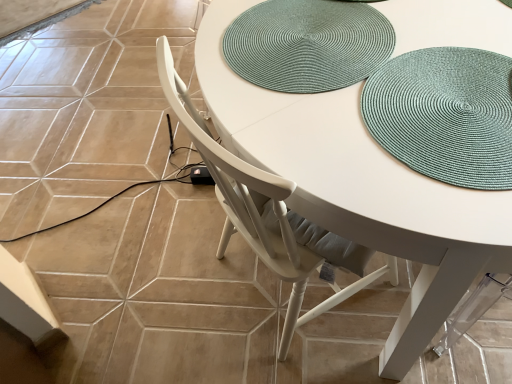
This screenshot has width=512, height=384. I want to click on vacant space to the right of teal woven placemat at upper center, so click(445, 42).